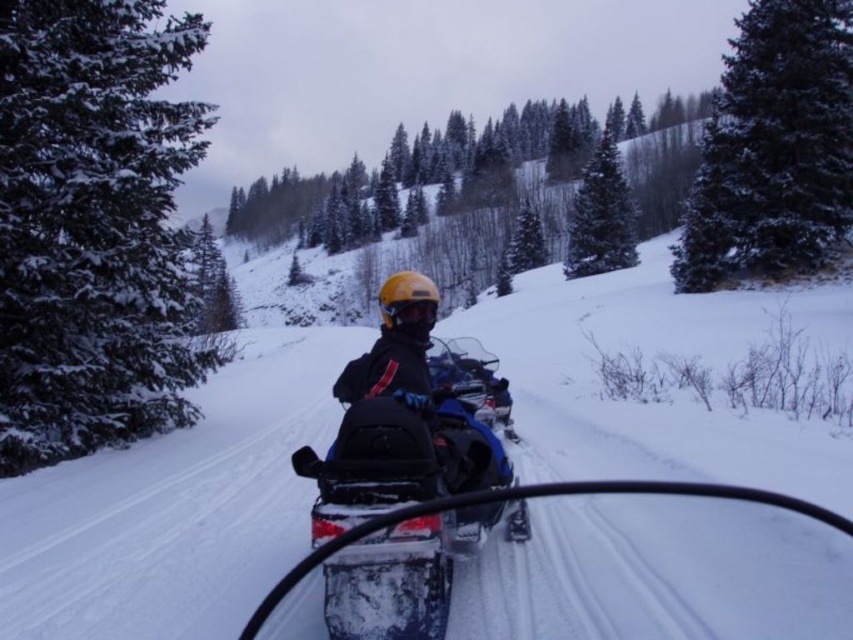
Does blue matte snowmobile at center have a larger size compared to snowy evergreen tree at upper right?

Incorrect, blue matte snowmobile at center is not larger than snowy evergreen tree at upper right.

Does blue matte snowmobile at center have a lesser width compared to snowy evergreen tree at upper right?

Indeed, blue matte snowmobile at center has a lesser width compared to snowy evergreen tree at upper right.

Who is more distant from viewer, (398, 566) or (831, 248)?

Point (831, 248)

Where is `blue matte snowmobile at center`? blue matte snowmobile at center is located at coordinates (397, 442).

Who is shorter, blue matte snowmobile at center or green matte pine at upper center?

blue matte snowmobile at center is shorter.

Who is higher up, blue matte snowmobile at center or green matte pine at upper center?

green matte pine at upper center is above.

The height and width of the screenshot is (640, 853). What do you see at coordinates (397, 442) in the screenshot? I see `blue matte snowmobile at center` at bounding box center [397, 442].

Find the location of `blue matte snowmobile at center`. blue matte snowmobile at center is located at coordinates 397,442.

Which is more to the right, snowy evergreen tree at upper right or green matte pine at upper center?

snowy evergreen tree at upper right is more to the right.

Does snowy evergreen tree at upper right appear on the left side of green matte pine at upper center?

In fact, snowy evergreen tree at upper right is to the right of green matte pine at upper center.

Where is `snowy evergreen tree at upper right`? Image resolution: width=853 pixels, height=640 pixels. snowy evergreen tree at upper right is located at coordinates (773, 148).